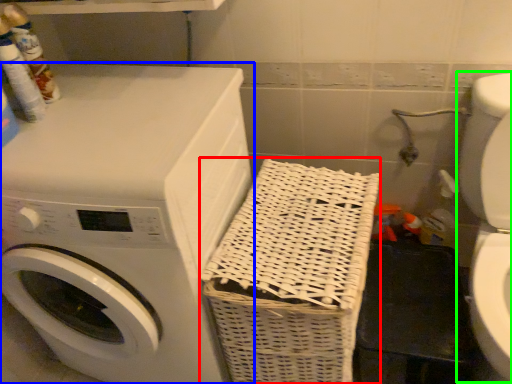
Question: Considering the real-world distances, which object is farthest from basket (highlighted by a red box)? washing machine (highlighted by a blue box) or washer (highlighted by a green box)?

Choices:
 (A) washing machine
 (B) washer

Answer: (B)